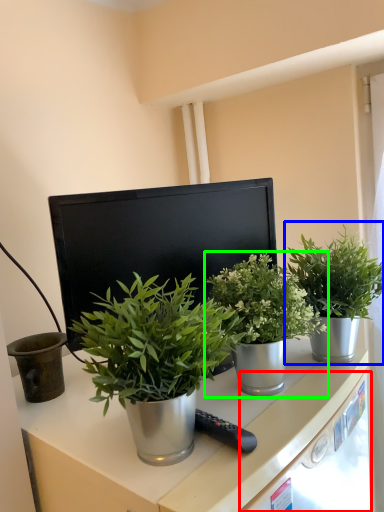
Question: Considering the real-world distances, which object is farthest from drawer (highlighted by a red box)? houseplant (highlighted by a blue box) or houseplant (highlighted by a green box)?

Choices:
 (A) houseplant
 (B) houseplant

Answer: (A)